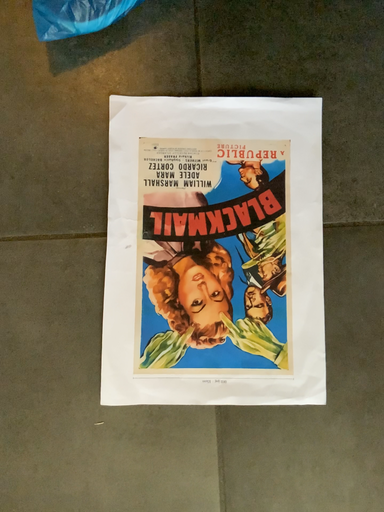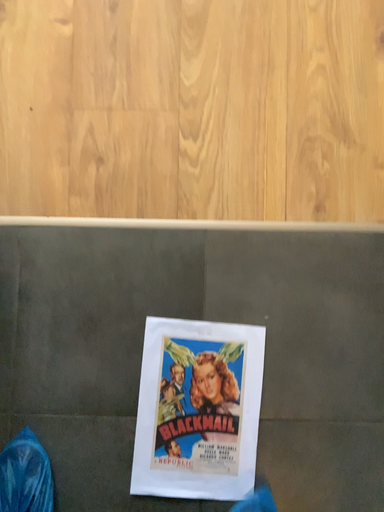
Question: Which way did the camera rotate in the video?

Choices:
 (A) rotated upward
 (B) rotated downward

Answer: (A)